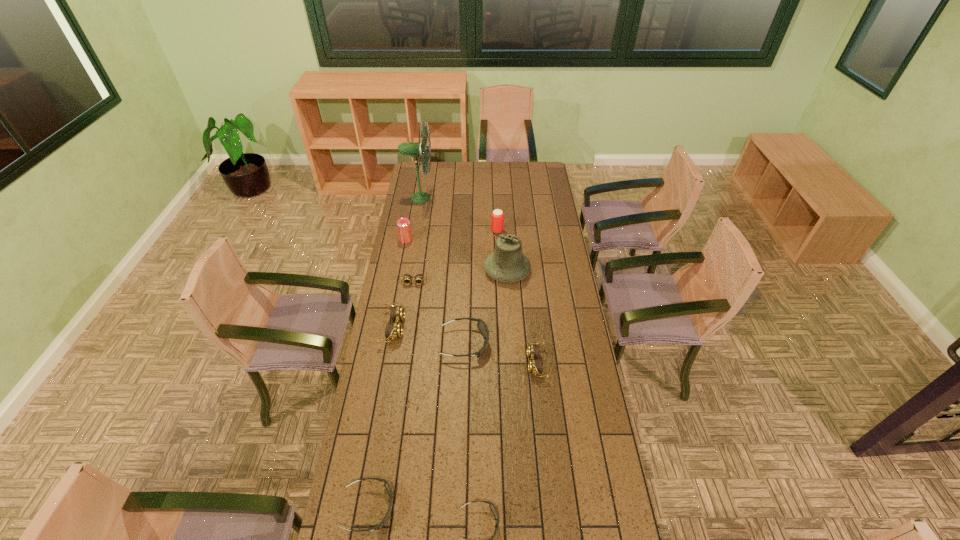
The image size is (960, 540). I want to click on vacant region located 0.340m on the lenses of the biggest black goggles, so click(x=569, y=343).

Locate an element on the screen. This screenshot has width=960, height=540. blank area located through the lenses of the rightmost brown goggles is located at coordinates (486, 363).

This screenshot has height=540, width=960. I want to click on free location located 0.170m through the lenses of the rightmost brown goggles, so click(x=486, y=363).

Locate an element on the screen. The height and width of the screenshot is (540, 960). blank space located 0.380m through the lenses of the rightmost brown goggles is located at coordinates (434, 363).

The image size is (960, 540). Find the location of `free region located 0.220m on the lenses of the leftmost black goggles`. free region located 0.220m on the lenses of the leftmost black goggles is located at coordinates (463, 508).

This screenshot has width=960, height=540. Identify the location of vacant space located 0.330m through the lenses of the farthest goggles. (405, 342).

Locate an element on the screen. The width and height of the screenshot is (960, 540). fan that is at the left edge is located at coordinates (415, 149).

This screenshot has width=960, height=540. I want to click on beer can present at the left edge, so pos(403,224).

What are the coordinates of `free space at the far edge` in the screenshot? It's located at (457, 180).

Find the location of a particular element. The width and height of the screenshot is (960, 540). free space at the left edge of the desktop is located at coordinates [x=389, y=313].